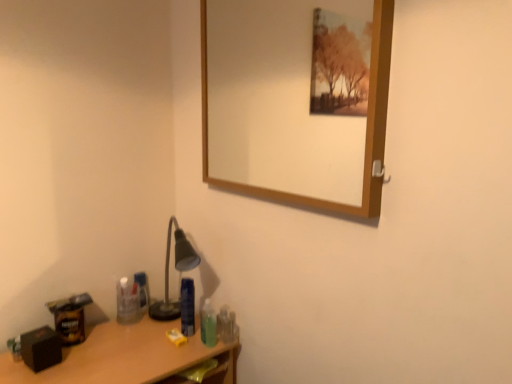
Image resolution: width=512 pixels, height=384 pixels. I want to click on free space to the back side of translucent plastic bottle at lower center, the first toiletry from the front, so click(x=203, y=322).